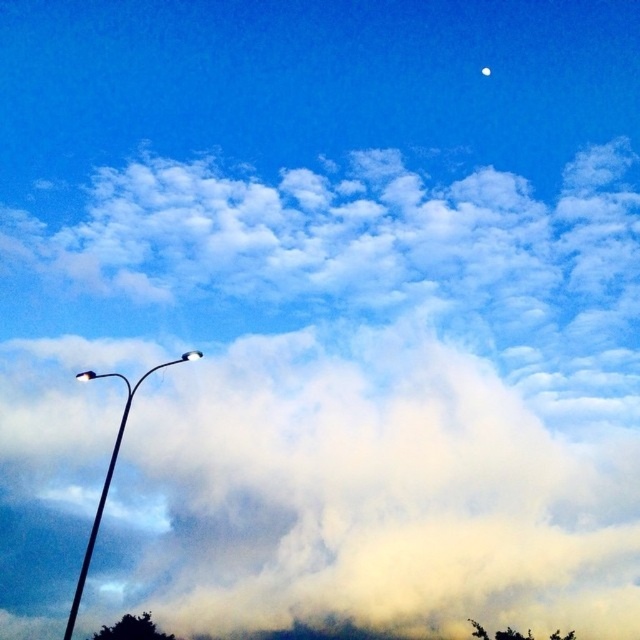
Is metallic street light at left closer to camera compared to white glossy moon at upper center?

Yes, metallic street light at left is closer to the viewer.

Is metallic street light at left positioned at the back of white glossy moon at upper center?

No, metallic street light at left is in front of white glossy moon at upper center.

The width and height of the screenshot is (640, 640). What do you see at coordinates (109, 472) in the screenshot?
I see `metallic street light at left` at bounding box center [109, 472].

This screenshot has height=640, width=640. I want to click on metallic street light at left, so click(x=109, y=472).

Which is more to the left, metallic pole at left or white glossy moon at upper center?

Positioned to the left is metallic pole at left.

Does metallic pole at left have a smaller size compared to white glossy moon at upper center?

No, metallic pole at left is not smaller than white glossy moon at upper center.

Identify the location of metallic pole at left. The height and width of the screenshot is (640, 640). (100, 493).

The image size is (640, 640). Find the location of `metallic pole at left`. metallic pole at left is located at coordinates click(100, 493).

Can you confirm if metallic street light at left is positioned to the right of metallic pole at left?

Yes, metallic street light at left is to the right of metallic pole at left.

Between point (97, 506) and point (100, 506), which one is positioned in front?

Point (100, 506) is in front.

Looking at this image, measure the distance between point (131, 390) and camera.

Point (131, 390) is 91.37 feet from camera.

The image size is (640, 640). Find the location of `metallic street light at left`. metallic street light at left is located at coordinates (x=109, y=472).